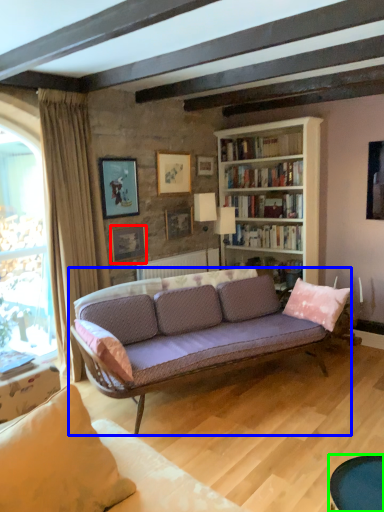
Question: Estimate the real-world distances between objects in this image. Which object is closer to picture frame (highlighted by a red box), studio couch (highlighted by a blue box) or table (highlighted by a green box)?

Choices:
 (A) studio couch
 (B) table

Answer: (A)